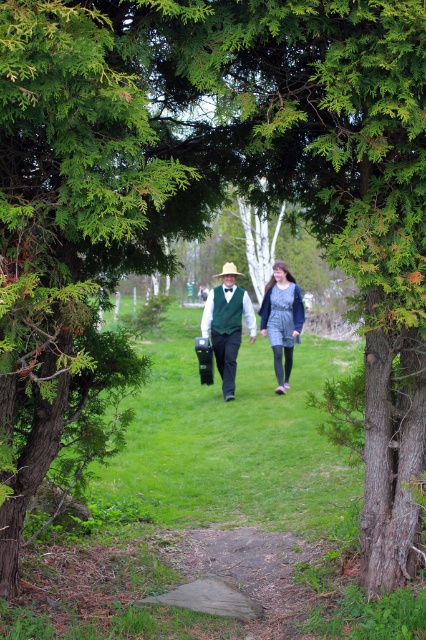
Question: In this image, where is matte green vest at center located relative to denim dress at center?

Choices:
 (A) left
 (B) right

Answer: (A)

Question: Which object appears farthest from the camera in this image?

Choices:
 (A) green textured tree at center
 (B) matte green vest at center

Answer: (B)

Question: Does green textured tree at center have a greater width compared to denim dress at center?

Choices:
 (A) no
 (B) yes

Answer: (B)

Question: Which of the following is the farthest from the observer?

Choices:
 (A) (48, 83)
 (B) (261, 321)

Answer: (B)

Question: Which point is closer to the camera taking this photo?

Choices:
 (A) (279, 266)
 (B) (63, 90)
 (C) (232, 268)

Answer: (B)

Question: Does matte green vest at center appear on the left side of denim dress at center?

Choices:
 (A) no
 (B) yes

Answer: (B)